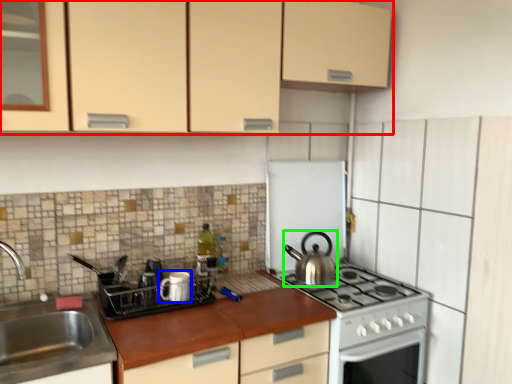
Question: Which object is positioned closest to cabinetry (highlighted by a red box)? Select from appliance (highlighted by a blue box) and kitchen appliance (highlighted by a green box).

Choices:
 (A) appliance
 (B) kitchen appliance

Answer: (A)